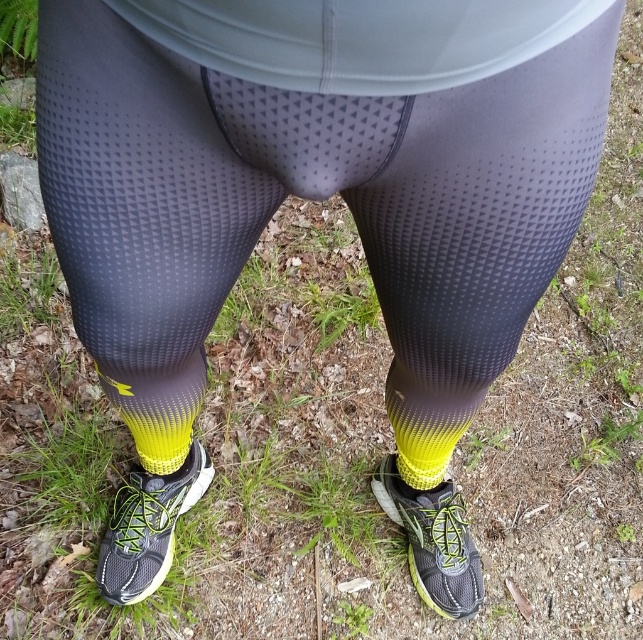
You are standing in a forest clearing and notice a yellow mesh shoe at lower center. Based on the coordinates provided in the description, can you determine if the shoe is closer to the bottom or the top of the image?

The yellow mesh shoe at lower center is located at point 0.825 on the y axis, which is closer to the bottom of the image since the y axis ranges from 0 at the top to 1 at the bottom.

Looking at this image, you are standing in a forest and see two points marked on the ground. The first point is at coordinate point (143, 480) and the second is at point (188, 362). If you are facing north, which point is closer to your back?

Point (143, 480) is behind point (188, 362), so if you are facing north, point (143, 480) would be closer to your back.

You are trying to decide whether to wear the matte black shoe at lower center or the yellow mesh sock at lower center for a hike. Based on their widths, which one would you choose if you want something wider?

The matte black shoe at lower center might be wider than yellow mesh sock at lower center, so you should choose the matte black shoe at lower center if you want something wider.